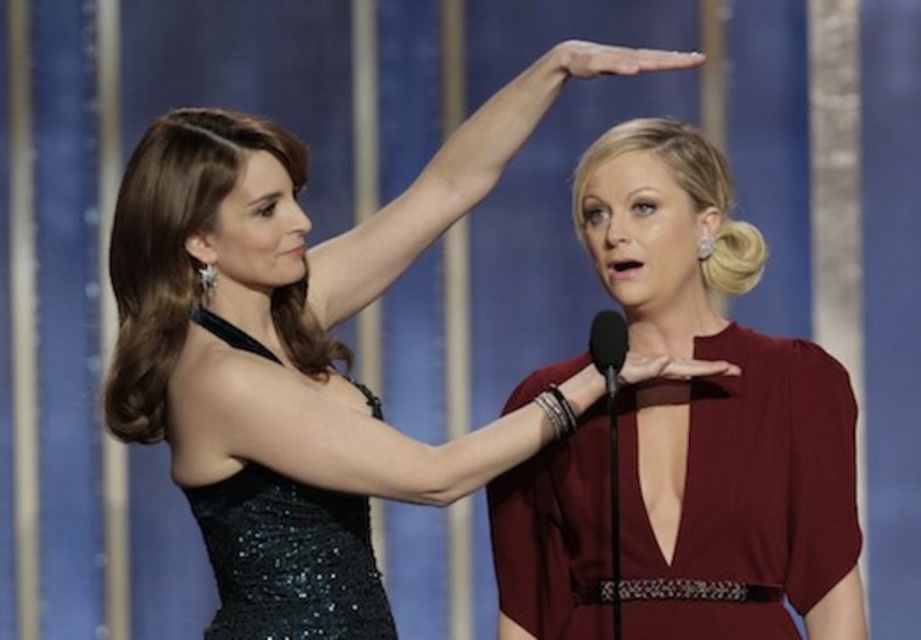
Does sequined black dress at center appear on the left side of black sequined dress at upper left?

In fact, sequined black dress at center is to the right of black sequined dress at upper left.

Who is taller, sequined black dress at center or black sequined dress at upper left?

sequined black dress at center

Which is behind, point (321, 488) or point (234, 637)?

The point (234, 637) is more distant.

Find the location of a particular element. sequined black dress at center is located at coordinates (304, 298).

Image resolution: width=921 pixels, height=640 pixels. Describe the element at coordinates (717, 412) in the screenshot. I see `burgundy satin dress at center` at that location.

Can you confirm if burgundy satin dress at center is positioned below black sequined dress at upper left?

Incorrect, burgundy satin dress at center is not positioned below black sequined dress at upper left.

The image size is (921, 640). What do you see at coordinates (717, 412) in the screenshot? I see `burgundy satin dress at center` at bounding box center [717, 412].

I want to click on burgundy satin dress at center, so click(x=717, y=412).

Is point (683, 132) positioned before point (176, 259)?

That is False.

Locate an element on the screen. This screenshot has height=640, width=921. burgundy satin dress at center is located at coordinates (717, 412).